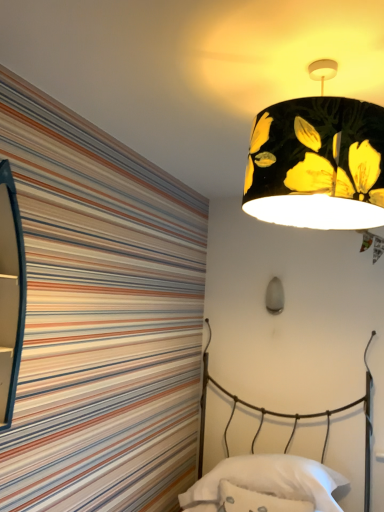
Question: From a real-world perspective, is white fluffy throw pillow at lower center positioned under matte gray bulb at center, the second lamp positioned from the top, based on gravity?

Choices:
 (A) no
 (B) yes

Answer: (B)

Question: Is white fluffy throw pillow at lower center smaller than matte gray bulb at center, acting as the first lamp starting from the back?

Choices:
 (A) no
 (B) yes

Answer: (A)

Question: From the image's perspective, is white fluffy throw pillow at lower center below matte gray bulb at center, which is the 1th lamp from bottom to top?

Choices:
 (A) no
 (B) yes

Answer: (B)

Question: Would you say white fluffy throw pillow at lower center is outside matte gray bulb at center, which is the 1th lamp from bottom to top?

Choices:
 (A) yes
 (B) no

Answer: (A)

Question: Are white fluffy throw pillow at lower center and matte gray bulb at center, which is the 1th lamp from bottom to top, making contact?

Choices:
 (A) yes
 (B) no

Answer: (B)

Question: Is white fluffy throw pillow at lower center at the right side of matte gray bulb at center, which is the 1th lamp from bottom to top?

Choices:
 (A) no
 (B) yes

Answer: (A)

Question: Considering the relative positions of white soft pillow at lower center and matte gray bulb at center, acting as the first lamp starting from the back, in the image provided, is white soft pillow at lower center behind matte gray bulb at center, acting as the first lamp starting from the back,?

Choices:
 (A) no
 (B) yes

Answer: (A)

Question: Is white soft pillow at lower center wider than matte gray bulb at center, the second lamp positioned from the top?

Choices:
 (A) yes
 (B) no

Answer: (A)

Question: Is there a large distance between white soft pillow at lower center and matte gray bulb at center, the second lamp from the front?

Choices:
 (A) no
 (B) yes

Answer: (A)

Question: Considering the relative sizes of white soft pillow at lower center and matte gray bulb at center, the second lamp positioned from the top, in the image provided, is white soft pillow at lower center taller than matte gray bulb at center, the second lamp positioned from the top,?

Choices:
 (A) no
 (B) yes

Answer: (A)

Question: From the image's perspective, is white soft pillow at lower center under matte gray bulb at center, the second lamp positioned from the top?

Choices:
 (A) yes
 (B) no

Answer: (A)

Question: From a real-world perspective, is white soft pillow at lower center over matte gray bulb at center, which is the 1th lamp from bottom to top?

Choices:
 (A) yes
 (B) no

Answer: (B)

Question: Is the depth of white soft pillow at lower center less than that of metallic wire bed at lower right?

Choices:
 (A) no
 (B) yes

Answer: (A)